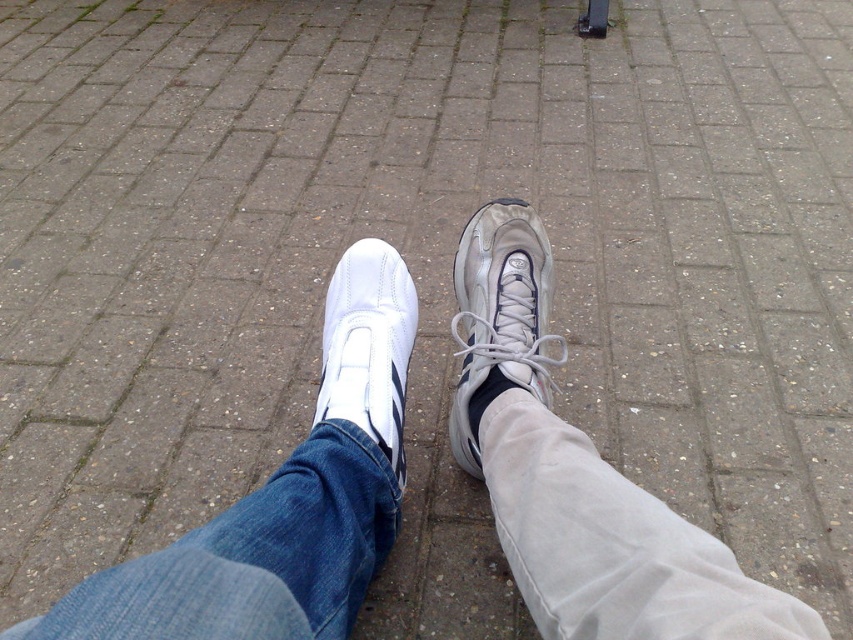
You are a shoe salesperson and a customer asks if the satin silver sneaker at center and the white leather shoe at left can fit into the same shoebox designed for larger shoes. Based on their sizes, what should you tell them?

The satin silver sneaker at center is larger than the white leather shoe at left. Therefore, the shoebox designed for larger shoes should accommodate the satin silver sneaker at center, but may not fit the white leather shoe at left properly.

You are standing 3 feet away from a camera. You want to take a photo of the satin silver sneaker at center. Can you reach it without moving your feet?

The satin silver sneaker at center and camera are 3.36 feet apart. Since you are only 3 feet away from the camera, the sneaker is 0.36 feet farther than your reach. You need to move closer to reach it.